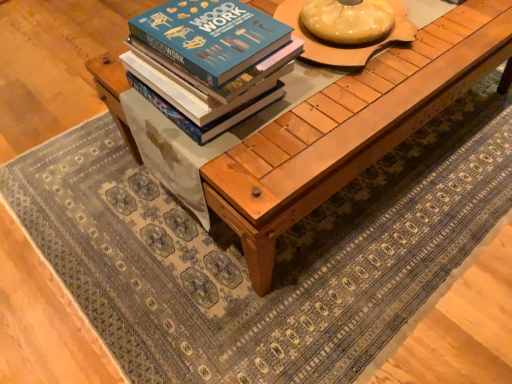
You are a GUI agent. You are given a task and a screenshot of the screen. Output one action in this format:
    pyautogui.click(x=<x>, y=<y>)
    Task: Click on the vacant region above blue matte book at center (from a real-world perspective)
    The width and height of the screenshot is (512, 384).
    Given the screenshot: What is the action you would take?
    pyautogui.click(x=199, y=31)